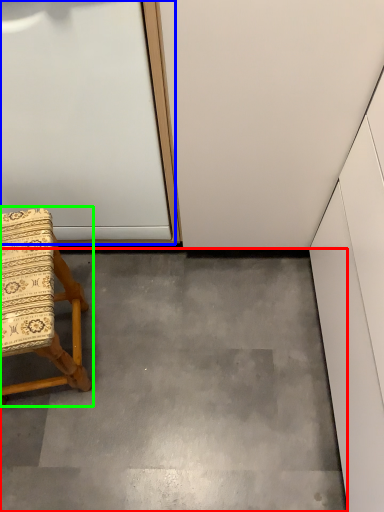
Question: Based on their relative distances, which object is farther from concrete (highlighted by a red box)? Choose from door (highlighted by a blue box) and chair (highlighted by a green box).

Choices:
 (A) door
 (B) chair

Answer: (A)